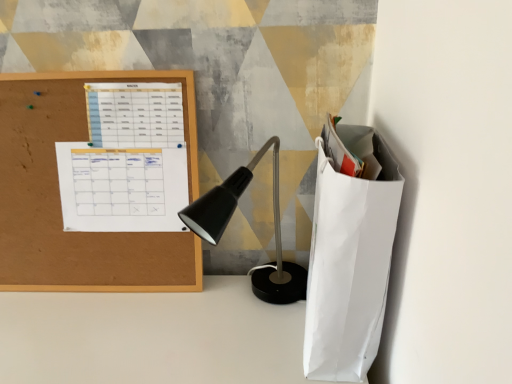
Where is `white paper calendar at upper left, arranged as the 2th notebook when ordered from the bottom`? The width and height of the screenshot is (512, 384). white paper calendar at upper left, arranged as the 2th notebook when ordered from the bottom is located at coordinates (135, 115).

I want to click on white paper calendar at upper left, the second notebook viewed from the top, so click(x=122, y=188).

The image size is (512, 384). Find the location of `white paper bag at right`. white paper bag at right is located at coordinates (349, 253).

Identify the location of cork board at left. pos(59,196).

Which object is more forward, cork board at left or white paper calendar at upper left, the second notebook viewed from the top?

Positioned in front is cork board at left.

Locate an element on the screen. Image resolution: width=512 pixels, height=384 pixels. the 2nd notebook behind when counting from the cork board at left is located at coordinates (122, 188).

Is point (15, 177) closer or farther from the camera than point (128, 213)?

Point (15, 177).

Considering the sizes of cork board at left and white paper calendar at upper left, the second notebook viewed from the top, in the image, is cork board at left bigger or smaller than white paper calendar at upper left, the second notebook viewed from the top,?

Considering their sizes, cork board at left takes up more space than white paper calendar at upper left, the second notebook viewed from the top.

Is white paper calendar at upper left, marked as the 1th notebook in a top-to-bottom arrangement, bigger or smaller than cork board at left?

In the image, white paper calendar at upper left, marked as the 1th notebook in a top-to-bottom arrangement, appears to be smaller than cork board at left.

Is white paper calendar at upper left, arranged as the 2th notebook when ordered from the bottom, aimed at cork board at left?

Yes, white paper calendar at upper left, arranged as the 2th notebook when ordered from the bottom, is aimed at cork board at left.

Do you think white paper calendar at upper left, arranged as the 2th notebook when ordered from the bottom, is within cork board at left, or outside of it?

white paper calendar at upper left, arranged as the 2th notebook when ordered from the bottom, lies outside cork board at left.

Considering the relative positions of white paper calendar at upper left, arranged as the 2th notebook when ordered from the bottom, and cork board at left in the image provided, is white paper calendar at upper left, arranged as the 2th notebook when ordered from the bottom, behind cork board at left?

Yes, white paper calendar at upper left, arranged as the 2th notebook when ordered from the bottom, is further from the viewer.

Which is behind, white paper calendar at upper left, arranged as the 2th notebook when ordered from the bottom, or white paper bag at right?

white paper calendar at upper left, arranged as the 2th notebook when ordered from the bottom, is behind.

The image size is (512, 384). In the image, there is a white paper calendar at upper left, arranged as the 2th notebook when ordered from the bottom. In order to click on paper bag below it (from a real-world perspective) in this screenshot , I will do `click(349, 253)`.

Which is in front, point (130, 86) or point (318, 142)?

The point (130, 86) is in front.

Can you confirm if white paper calendar at upper left, marked as the 1th notebook in a top-to-bottom arrangement, is taller than white paper bag at right?

No.

Considering their positions, is white paper bag at right located in front of or behind cork board at left?

white paper bag at right is positioned closer to the viewer than cork board at left.

Does white paper bag at right have a greater height compared to cork board at left?

In fact, white paper bag at right may be shorter than cork board at left.

Does white paper bag at right appear on the right side of cork board at left?

Yes, white paper bag at right is to the right of cork board at left.

Between white paper bag at right and cork board at left, which one has larger size?

Bigger between the two is white paper bag at right.

Considering the relative sizes of white paper calendar at upper left, marked as the 1th notebook in a top-to-bottom arrangement, and white paper calendar at upper left, the second notebook viewed from the top, in the image provided, is white paper calendar at upper left, marked as the 1th notebook in a top-to-bottom arrangement, wider than white paper calendar at upper left, the second notebook viewed from the top,?

No.

Is white paper calendar at upper left, arranged as the 2th notebook when ordered from the bottom, shorter than white paper calendar at upper left, the second notebook viewed from the top?

Indeed, white paper calendar at upper left, arranged as the 2th notebook when ordered from the bottom, has a lesser height compared to white paper calendar at upper left, the second notebook viewed from the top.

Identify the location of notebook located on the right of white paper calendar at upper left, the second notebook viewed from the top. The image size is (512, 384). (135, 115).

Which object is closer to the camera, white paper calendar at upper left, which appears as the 1th notebook when ordered from the bottom, or white paper bag at right?

white paper bag at right.

Can you confirm if white paper calendar at upper left, which appears as the 1th notebook when ordered from the bottom, is positioned to the right of white paper bag at right?

No, white paper calendar at upper left, which appears as the 1th notebook when ordered from the bottom, is not to the right of white paper bag at right.

Would you say white paper calendar at upper left, the second notebook viewed from the top, contains white paper bag at right?

No.

In the scene shown: From a real-world perspective, between white paper calendar at upper left, the second notebook viewed from the top, and white paper bag at right, who is vertically higher?

From a 3D spatial view, white paper calendar at upper left, the second notebook viewed from the top, is above.

Between cork board at left and white paper calendar at upper left, marked as the 1th notebook in a top-to-bottom arrangement, which one has larger width?

With larger width is cork board at left.

Would you say cork board at left is a long distance from white paper calendar at upper left, arranged as the 2th notebook when ordered from the bottom?

That's not correct — cork board at left is a little close to white paper calendar at upper left, arranged as the 2th notebook when ordered from the bottom.

Is cork board at left further to camera compared to white paper calendar at upper left, marked as the 1th notebook in a top-to-bottom arrangement?

That is False.

How many degrees apart are the facing directions of cork board at left and white paper calendar at upper left, marked as the 1th notebook in a top-to-bottom arrangement?

0.00145 degrees separate the facing orientations of cork board at left and white paper calendar at upper left, marked as the 1th notebook in a top-to-bottom arrangement.

You are a GUI agent. You are given a task and a screenshot of the screen. Output one action in this format:
    pyautogui.click(x=<x>, y=<y>)
    Task: Click on the office supplies to the left of white paper calendar at upper left, the second notebook viewed from the top
    The height and width of the screenshot is (384, 512).
    Given the screenshot: What is the action you would take?
    pyautogui.click(x=59, y=196)

Locate an element on the screen. The image size is (512, 384). office supplies lying below the white paper calendar at upper left, arranged as the 2th notebook when ordered from the bottom (from the image's perspective) is located at coordinates (59, 196).

Which object lies further to the anchor point white paper calendar at upper left, marked as the 1th notebook in a top-to-bottom arrangement, white paper calendar at upper left, the second notebook viewed from the top, or white paper bag at right?

The object further to white paper calendar at upper left, marked as the 1th notebook in a top-to-bottom arrangement, is white paper bag at right.

When comparing their distances from white paper calendar at upper left, marked as the 1th notebook in a top-to-bottom arrangement, does cork board at left or white paper bag at right seem further?

white paper bag at right lies further to white paper calendar at upper left, marked as the 1th notebook in a top-to-bottom arrangement, than the other object.

From the image, which object appears to be nearer to cork board at left, white paper bag at right or white paper calendar at upper left, which appears as the 1th notebook when ordered from the bottom?

white paper calendar at upper left, which appears as the 1th notebook when ordered from the bottom, is positioned closer to the anchor cork board at left.

When comparing their distances from cork board at left, does white paper calendar at upper left, marked as the 1th notebook in a top-to-bottom arrangement, or white paper bag at right seem further?

white paper bag at right lies further to cork board at left than the other object.

Based on their spatial positions, is white paper calendar at upper left, arranged as the 2th notebook when ordered from the bottom, or cork board at left further from white paper bag at right?

cork board at left lies further to white paper bag at right than the other object.

Estimate the real-world distances between objects in this image. Which object is further from white paper calendar at upper left, the second notebook viewed from the top, white paper calendar at upper left, marked as the 1th notebook in a top-to-bottom arrangement, or cork board at left?

white paper calendar at upper left, marked as the 1th notebook in a top-to-bottom arrangement, is further to white paper calendar at upper left, the second notebook viewed from the top.

In the scene shown: Which object lies nearer to the anchor point white paper bag at right, white paper calendar at upper left, which appears as the 1th notebook when ordered from the bottom, or white paper calendar at upper left, marked as the 1th notebook in a top-to-bottom arrangement?

Based on the image, white paper calendar at upper left, which appears as the 1th notebook when ordered from the bottom, appears to be nearer to white paper bag at right.

Which object lies nearer to the anchor point white paper calendar at upper left, which appears as the 1th notebook when ordered from the bottom, cork board at left or white paper calendar at upper left, marked as the 1th notebook in a top-to-bottom arrangement?

Based on the image, cork board at left appears to be nearer to white paper calendar at upper left, which appears as the 1th notebook when ordered from the bottom.

What are the coordinates of `notebook situated between white paper calendar at upper left, which appears as the 1th notebook when ordered from the bottom, and white paper bag at right from left to right` in the screenshot? It's located at (135, 115).

Image resolution: width=512 pixels, height=384 pixels. In order to click on office supplies between white paper calendar at upper left, marked as the 1th notebook in a top-to-bottom arrangement, and white paper calendar at upper left, which appears as the 1th notebook when ordered from the bottom, in the vertical direction in this screenshot , I will do `click(59, 196)`.